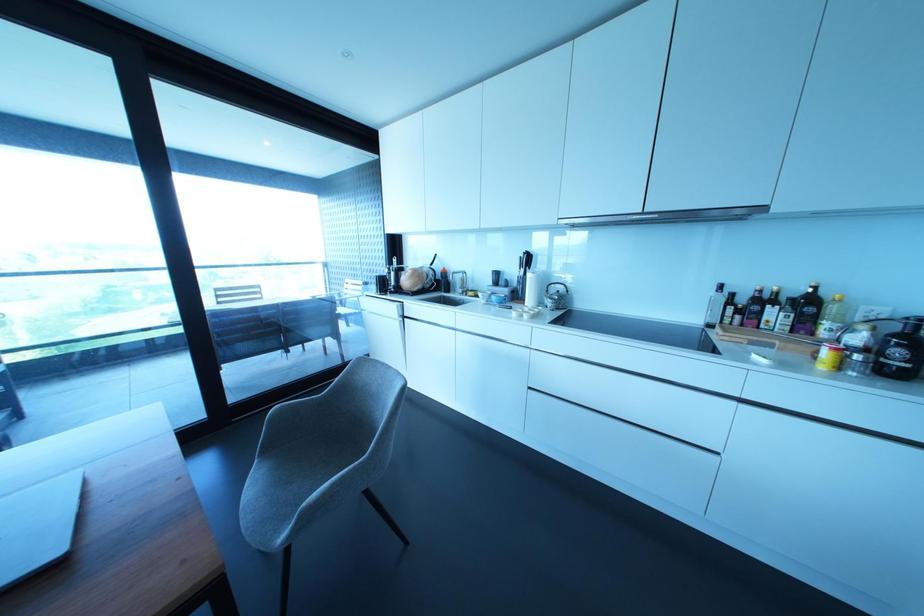
Where would you sit the chair sitting surface? Please return your answer as a coordinate pair (x, y).

(290, 484)